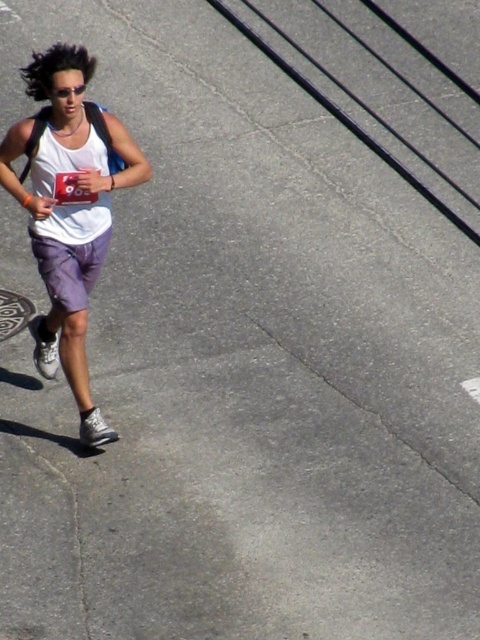
Question: Does white matte tank top at left lie behind purple cotton shorts at lower left?

Choices:
 (A) yes
 (B) no

Answer: (B)

Question: Is white matte tank top at left bigger than purple cotton shorts at lower left?

Choices:
 (A) yes
 (B) no

Answer: (A)

Question: Does white matte tank top at left appear on the right side of purple cotton shorts at lower left?

Choices:
 (A) no
 (B) yes

Answer: (B)

Question: Among these points, which one is nearest to the camera?

Choices:
 (A) (39, 58)
 (B) (68, 273)

Answer: (A)